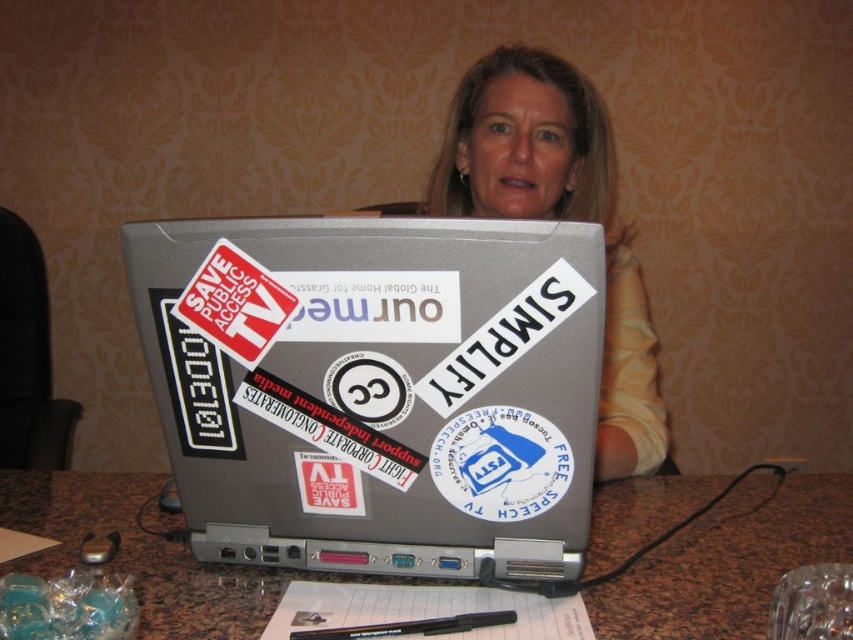
Does point (427, 248) come farther from viewer compared to point (469, 474)?

No.

Does silver/stainless steel laptop at center have a lesser width compared to white paper sticker at center?

No.

Measure the distance between point (373,419) and camera.

The distance of point (373,419) from camera is 67.53 centimeters.

Locate an element on the screen. silver/stainless steel laptop at center is located at coordinates (383, 394).

Which is more to the right, blonde hair at center or white paper sticker at center?

blonde hair at center is more to the right.

Measure the distance between blonde hair at center and camera.

37.41 inches

At what (x,y) coordinates should I click in order to perform the action: click on blonde hair at center. Please return your answer as a coordinate pair (x, y). Looking at the image, I should click on (556, 216).

Can you confirm if marble table at lower center is positioned below blonde hair at center?

Yes.

Identify the location of marble table at lower center. The image size is (853, 640). (728, 561).